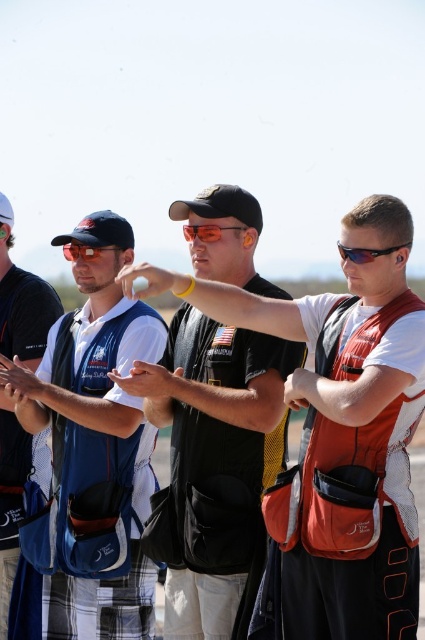
You are a participant in the shooting event and need to move from the starting point to the target area. The starting point is at point (x=119, y=244) and the target area is at point (x=5, y=198). Based on the scene description, which direction should you move to reach the target area from the starting point?

Point (x=119, y=244) is in front of point (x=5, y=198), so you should move backward to reach the target area from the starting point.

You are a photographer at a shooting range. You need to capture a photo of the dark blue fabric baseball cap at left and the black fabric baseball cap at upper left. Which cap is positioned lower in the image?

The dark blue fabric baseball cap at left is positioned below the black fabric baseball cap at upper left, so the dark blue fabric baseball cap at left is lower in the image.

What is the color of the vest worn by the person at the point with coordinates (23, 307)?

The blue fabric vest at left is represented by point (23, 307).